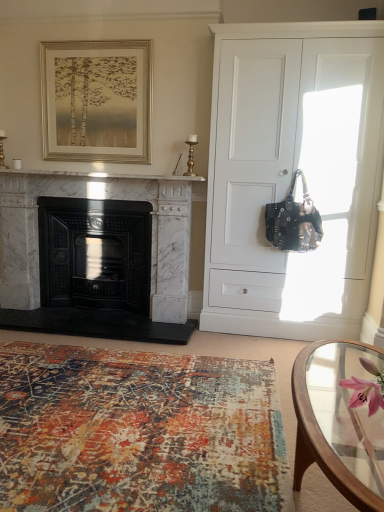
Question: From the image's perspective, is pink silk flower at lower right located beneath black cast iron fireplace at left, which is the 1th fireplace in left-to-right order?

Choices:
 (A) no
 (B) yes

Answer: (B)

Question: Can you confirm if pink silk flower at lower right is shorter than black cast iron fireplace at left, which is counted as the 2th fireplace, starting from the right?

Choices:
 (A) yes
 (B) no

Answer: (A)

Question: Is pink silk flower at lower right in front of black cast iron fireplace at left, which is counted as the 2th fireplace, starting from the right?

Choices:
 (A) no
 (B) yes

Answer: (B)

Question: Is black cast iron fireplace at left, which is the 1th fireplace in left-to-right order, at the back of pink silk flower at lower right?

Choices:
 (A) no
 (B) yes

Answer: (A)

Question: Can you confirm if pink silk flower at lower right is wider than black cast iron fireplace at left, which is the 1th fireplace in left-to-right order?

Choices:
 (A) yes
 (B) no

Answer: (B)

Question: Are pink silk flower at lower right and black cast iron fireplace at left, which is counted as the 2th fireplace, starting from the right, located far from each other?

Choices:
 (A) yes
 (B) no

Answer: (A)

Question: Can you confirm if white matte cabinet at right is bigger than clear glass coffee table at lower right?

Choices:
 (A) no
 (B) yes

Answer: (B)

Question: Is white matte cabinet at right smaller than clear glass coffee table at lower right?

Choices:
 (A) no
 (B) yes

Answer: (A)

Question: Is white matte cabinet at right at the right side of clear glass coffee table at lower right?

Choices:
 (A) yes
 (B) no

Answer: (A)

Question: From a real-world perspective, is white matte cabinet at right on top of clear glass coffee table at lower right?

Choices:
 (A) no
 (B) yes

Answer: (B)

Question: Considering the relative sizes of white matte cabinet at right and clear glass coffee table at lower right in the image provided, is white matte cabinet at right wider than clear glass coffee table at lower right?

Choices:
 (A) yes
 (B) no

Answer: (A)

Question: From a real-world perspective, is white matte cabinet at right under clear glass coffee table at lower right?

Choices:
 (A) no
 (B) yes

Answer: (A)

Question: Does clear glass coffee table at lower right have a lesser width compared to gold-toned wooden frame at upper center?

Choices:
 (A) no
 (B) yes

Answer: (A)